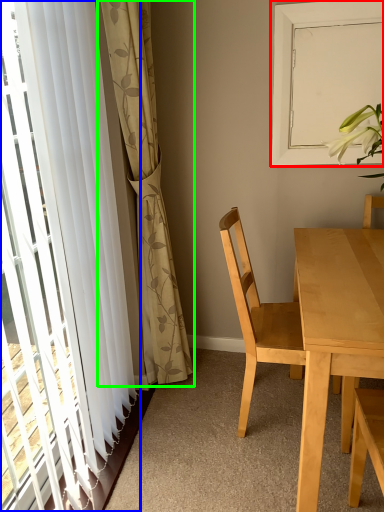
Question: Estimate the real-world distances between objects in this image. Which object is farther from window screen (highlighted by a red box), curtain (highlighted by a blue box) or curtain (highlighted by a green box)?

Choices:
 (A) curtain
 (B) curtain

Answer: (A)